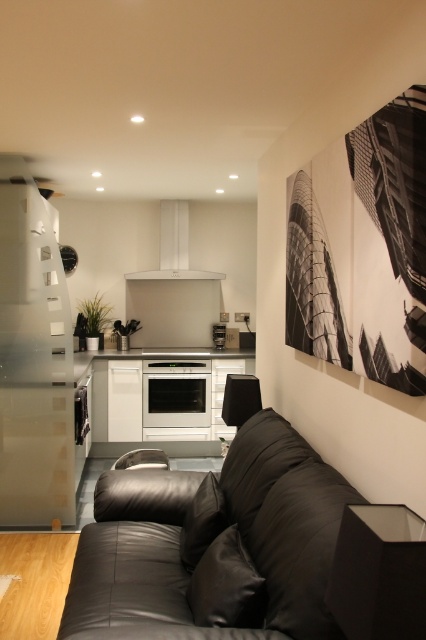
Question: Is white glossy exhaust hood at center thinner than white glossy oven at center?

Choices:
 (A) no
 (B) yes

Answer: (A)

Question: Is matte black side table at lower right behind white glossy exhaust hood at center?

Choices:
 (A) no
 (B) yes

Answer: (A)

Question: Is white glossy exhaust hood at center to the right of white glossy oven at center from the viewer's perspective?

Choices:
 (A) no
 (B) yes

Answer: (A)

Question: Which object appears farthest from the camera in this image?

Choices:
 (A) white glossy oven at center
 (B) matte black side table at lower right
 (C) black leather couch at lower center

Answer: (A)

Question: Which point is farther to the camera?

Choices:
 (A) matte black side table at lower right
 (B) white glossy oven at center
 (C) satin silver oven at center

Answer: (B)

Question: Among these points, which one is nearest to the camera?

Choices:
 (A) (121, 600)
 (B) (190, 413)
 (C) (213, 333)
 (D) (175, 211)

Answer: (A)